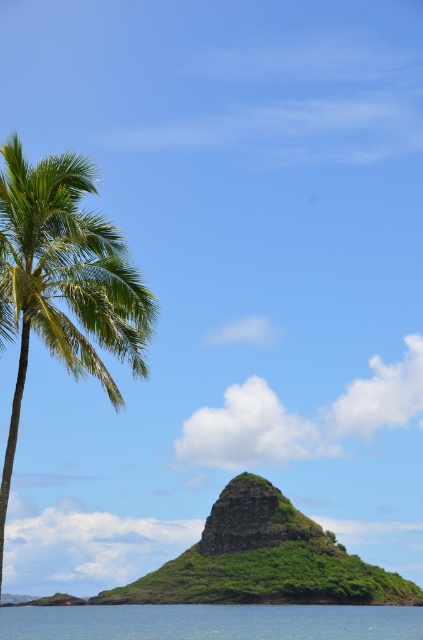
You are a bird flying over the tropical landscape. You see the green leafy palm tree at left and the green grassy rock at center. Which object would you need to fly closer to in order to land?

The green leafy palm tree at left is closer to the viewer than the green grassy rock at center, so you would need to fly closer to the green grassy rock at center to land.

You are standing on the palm tree on the left side of the frame and want to reach the rocky island in the center right. Which direction should you go to avoid the blue water at lower center?

To avoid the blue water at lower center, you should head directly towards the rocky island in the center right since the blue water at lower center is located at point (211, 621), which is below and to the right of your current position on the palm tree. Moving straight towards the island would bypass the water area.

You are a boat captain navigating through the blue water at lower center and need to avoid the green leafy palm tree at left. Based on their widths, which one is narrower?

The green leafy palm tree at left is thinner than the blue water at lower center, so the green leafy palm tree at left is narrower.